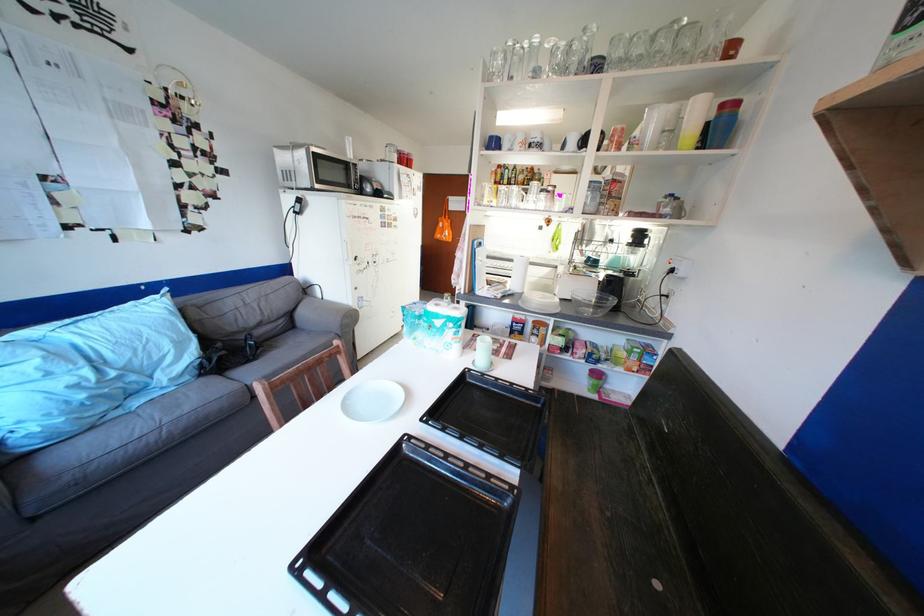
Find where to pull the refrigerator handle. Please return your answer as a coordinate pair (x, y).

(346, 252)